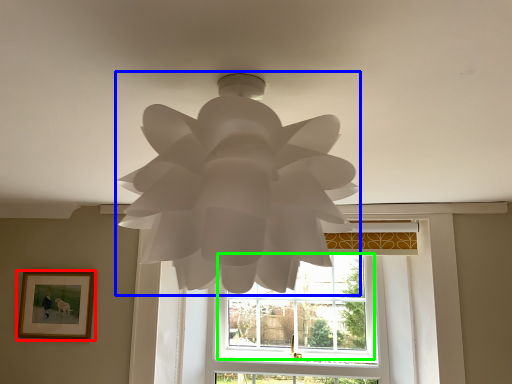
Question: Considering the real-world distances, which object is closest to picture frame (highlighted by a red box)? lamp (highlighted by a blue box) or window (highlighted by a green box).

Choices:
 (A) lamp
 (B) window

Answer: (B)